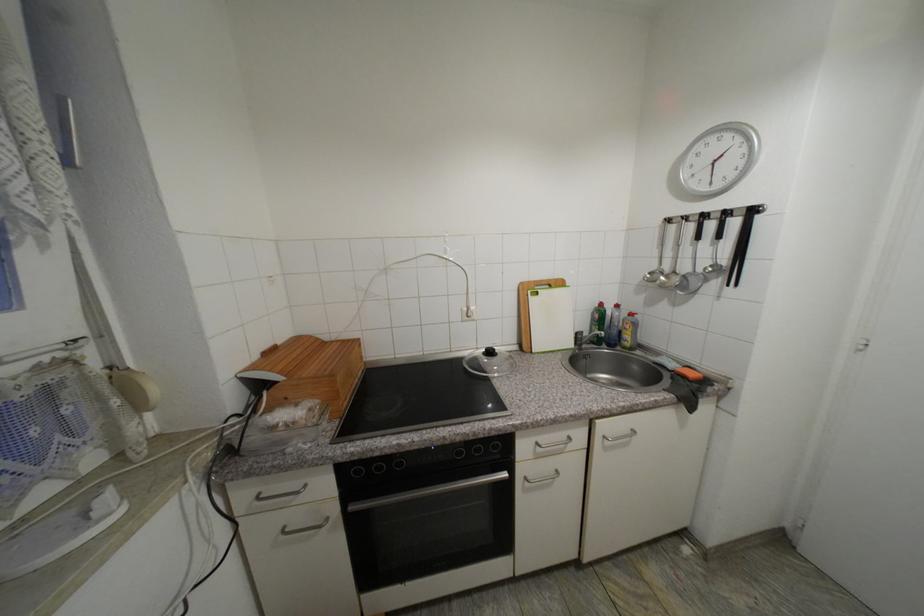
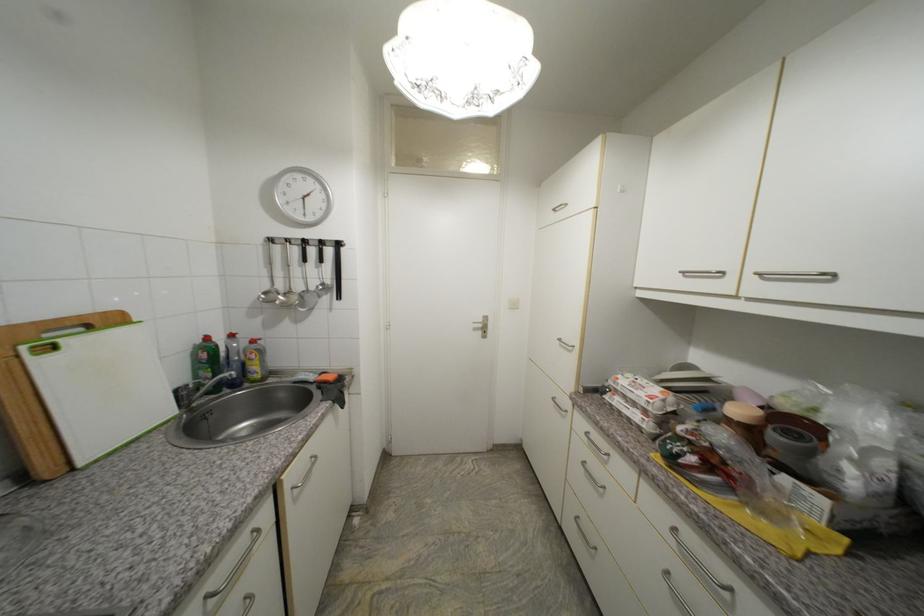
The point at (x=602, y=317) is marked in the first image. Where is the corresponding point in the second image?

(210, 357)